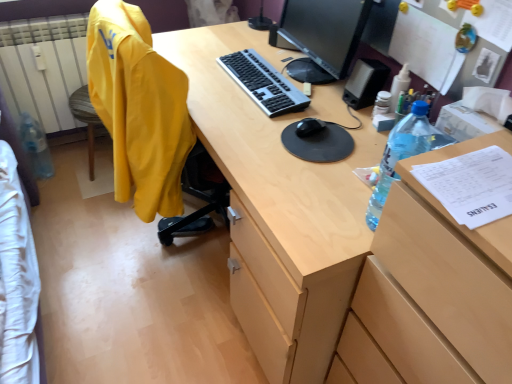
Identify the location of free area behind translucent plastic bottle at right, the 2th bottle from the left. (349, 175).